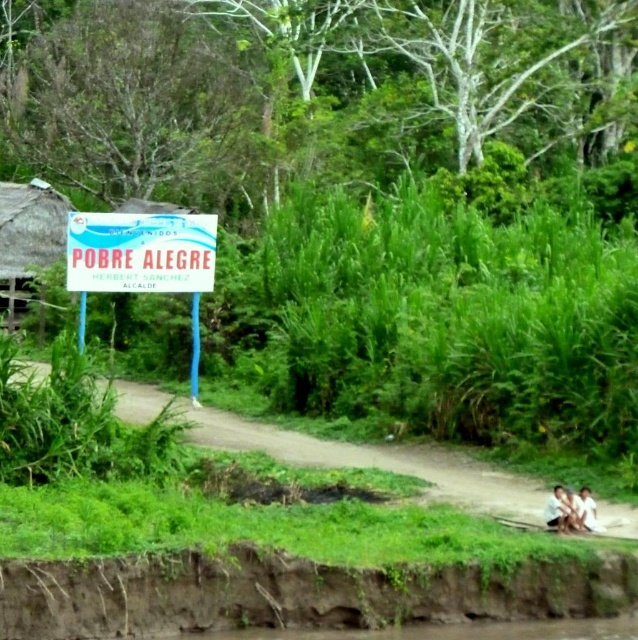
Does point (609, 605) lie in front of point (561, 504)?

Yes.

Is point (584, 570) positioned in front of point (570, 506)?

Yes, it is.

Where is `brown dirt river bank at lower left`? This screenshot has height=640, width=638. brown dirt river bank at lower left is located at coordinates (293, 593).

Between point (98, 232) and point (100, 253), which one is positioned in front?

Positioned in front is point (98, 232).

Does white plastic sign at left have a lesser height compared to white plastic sign at upper left?

In fact, white plastic sign at left may be taller than white plastic sign at upper left.

Measure the distance between white plastic sign at left and camera.

The distance of white plastic sign at left from camera is 18.57 meters.

Locate an element on the screen. Image resolution: width=638 pixels, height=640 pixels. white plastic sign at left is located at coordinates (142, 260).

Between point (112, 268) and point (554, 529), which one is positioned behind?

The point (112, 268) is more distant.

What do you see at coordinates (140, 252) in the screenshot? The height and width of the screenshot is (640, 638). I see `white plastic sign at upper left` at bounding box center [140, 252].

Find the location of a particular element. The width and height of the screenshot is (638, 640). white plastic sign at upper left is located at coordinates (140, 252).